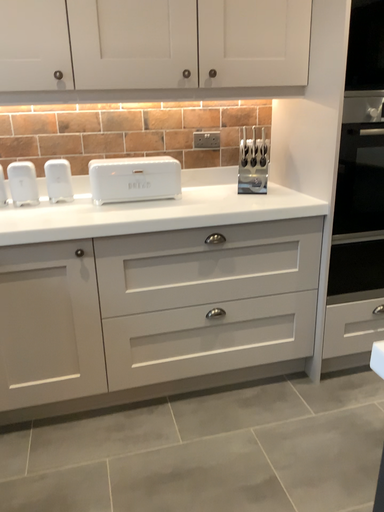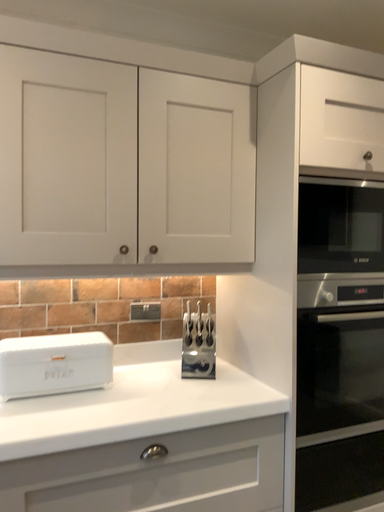
Question: Which way did the camera rotate in the video?

Choices:
 (A) rotated right
 (B) rotated left

Answer: (A)